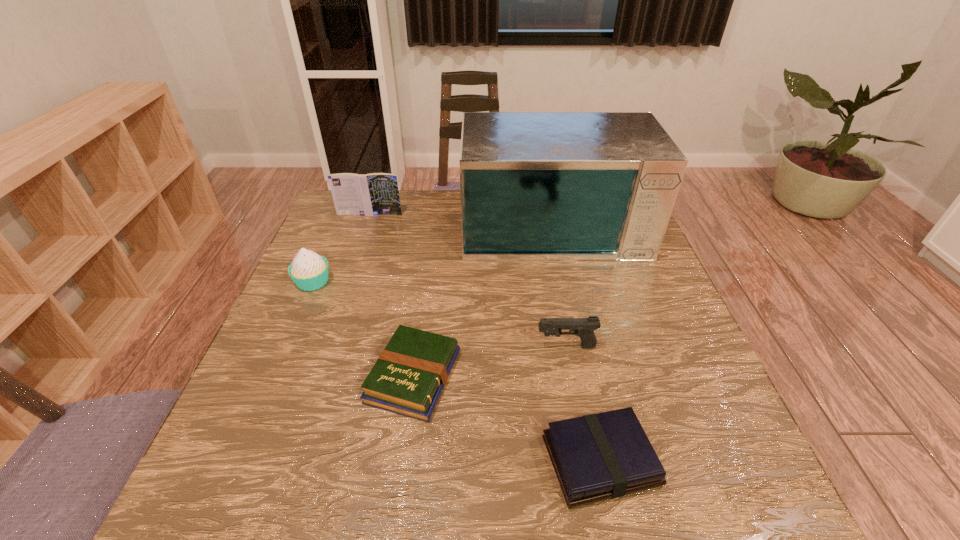
Locate an element on the screen. The image size is (960, 540). object present at the right edge is located at coordinates (535, 186).

This screenshot has height=540, width=960. I want to click on object present at the far left corner, so click(372, 194).

Locate an element on the screen. object present at the far right corner is located at coordinates (535, 186).

Identify the location of vacant space at the far edge. This screenshot has width=960, height=540. (x=429, y=202).

At what (x,y) coordinates should I click in order to perform the action: click on vacant space at the near edge of the desktop. Please return your answer as a coordinate pair (x, y). Looking at the image, I should click on (500, 484).

Identify the location of free space at the left edge of the desktop. (341, 261).

In the image, there is a desktop. Where is `vacant region at the right edge`? This screenshot has height=540, width=960. vacant region at the right edge is located at coordinates (703, 360).

The width and height of the screenshot is (960, 540). What are the coordinates of `vacant position at the near right corner of the desktop` in the screenshot? It's located at (760, 494).

Identify the location of vacant area that lies between the leftmost book and the microwave oven. This screenshot has height=540, width=960. (461, 218).

The height and width of the screenshot is (540, 960). In order to click on vacant point located between the pistol and the microwave oven in this screenshot , I will do `click(559, 284)`.